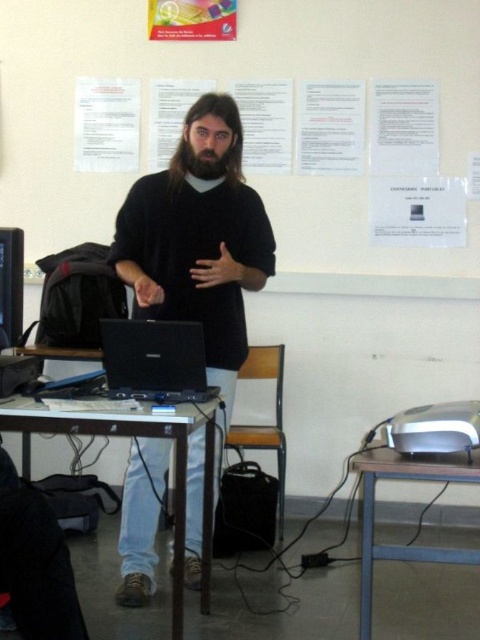
You are sitting in the classroom and want to determine which of the two points, point (175,435) or point (211,150), is closer to you. Based on the scene, which point is nearer?

Point (175,435) is closer to the viewer than point (211,150).